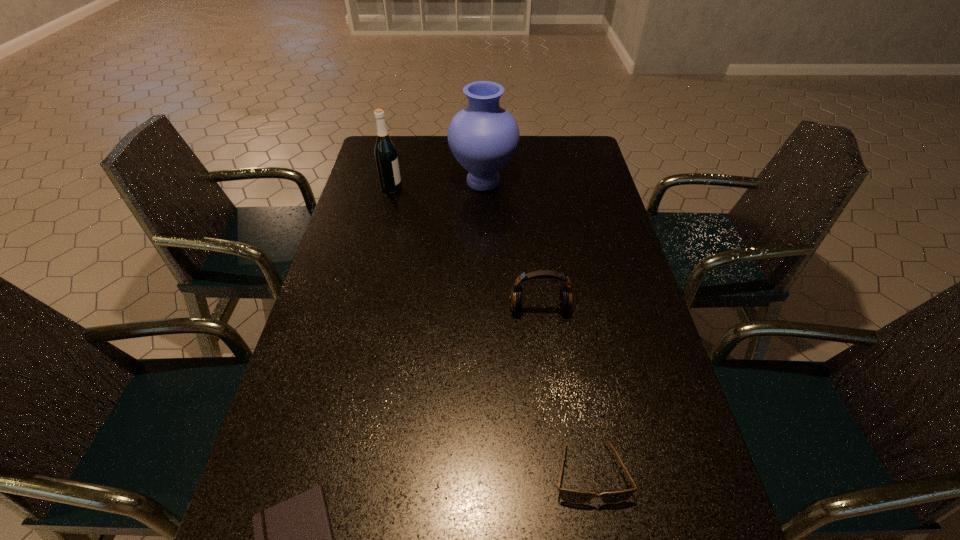
Find the location of a particular element. vase is located at coordinates (483, 137).

Identify the location of wine bottle. (385, 152).

I want to click on headset, so (565, 299).

This screenshot has height=540, width=960. Identify the location of the third nearest object. (565, 299).

Image resolution: width=960 pixels, height=540 pixels. I want to click on the second shortest object, so click(570, 496).

You are a GUI agent. You are given a task and a screenshot of the screen. Output one action in this format:
    pyautogui.click(x=<x>, y=<y>)
    Task: Click on the vacant space located 0.170m on the left of the vase
    The width and height of the screenshot is (960, 540).
    Given the screenshot: What is the action you would take?
    pyautogui.click(x=402, y=181)

The height and width of the screenshot is (540, 960). What are the coordinates of `free spot located 0.160m on the label of the wine bottle` in the screenshot? It's located at (447, 188).

Where is `free region located on the ear cups of the third shortest object`? The width and height of the screenshot is (960, 540). free region located on the ear cups of the third shortest object is located at coordinates (547, 373).

At what (x,y) coordinates should I click in order to perform the action: click on free space located 0.050m on the frames of the fourth tallest object. Please return your answer as a coordinate pair (x, y). Looking at the image, I should click on (600, 535).

Locate an element on the screen. The height and width of the screenshot is (540, 960). object present at the far edge is located at coordinates (483, 137).